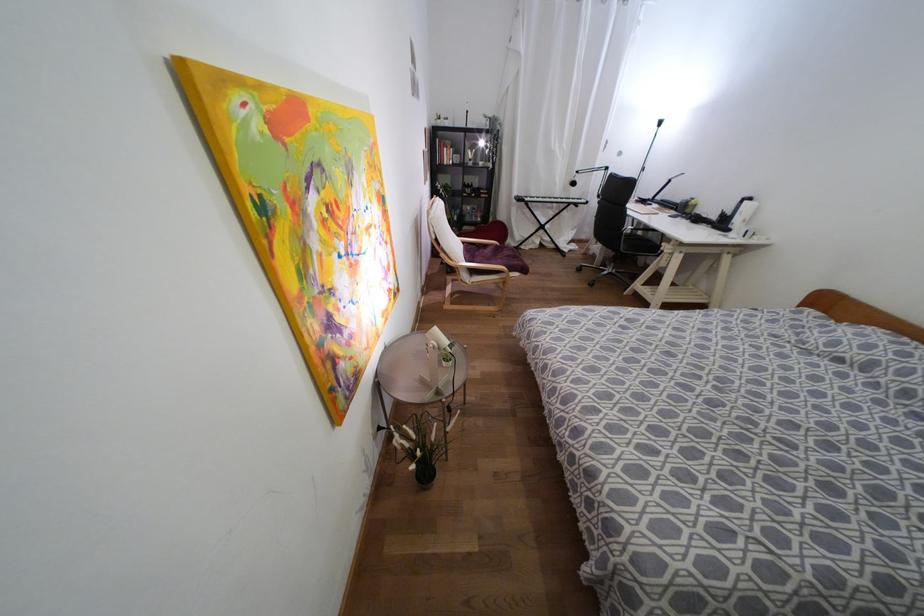
Where is `acoustic guitar`? acoustic guitar is located at coordinates (570, 179).